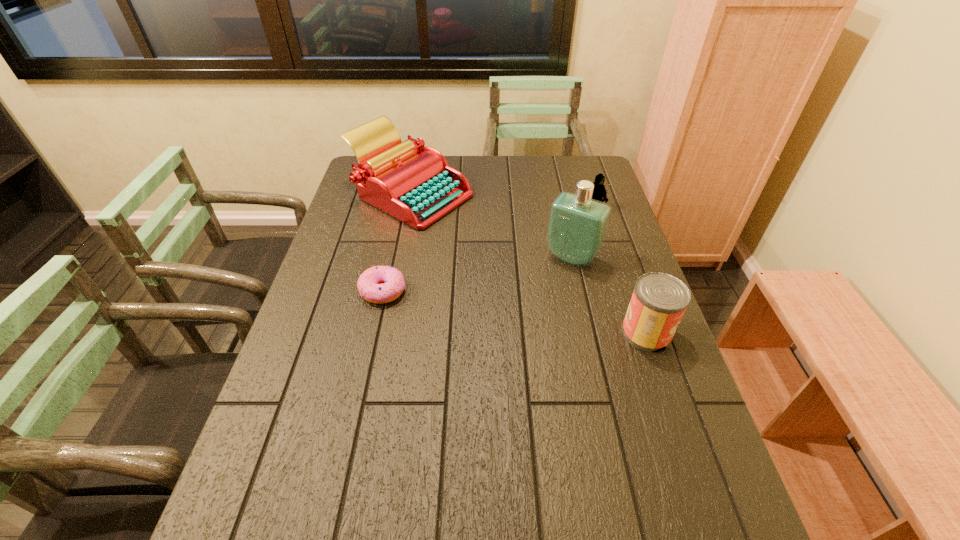
Identify the location of empty location between the shortest object and the fourth shortest object. Image resolution: width=960 pixels, height=540 pixels. (396, 242).

At what (x,y) coordinates should I click in order to perform the action: click on empty space that is in between the fourth tallest object and the typewriter. Please return your answer as a coordinate pair (x, y). Looking at the image, I should click on (502, 201).

What are the coordinates of `empty location between the typewriter and the doughnut` in the screenshot? It's located at (396, 242).

At what (x,y) coordinates should I click in order to perform the action: click on vacant region between the Lego and the third tallest object. Please return your answer as a coordinate pair (x, y). The width and height of the screenshot is (960, 540). Looking at the image, I should click on (620, 270).

The image size is (960, 540). I want to click on vacant space that's between the tallest object and the can, so click(x=610, y=295).

Where is `empty location between the perfume and the nearest object`? empty location between the perfume and the nearest object is located at coordinates (610, 295).

The height and width of the screenshot is (540, 960). Identify the location of empty space between the shortest object and the third tallest object. (515, 312).

You are a GUI agent. You are given a task and a screenshot of the screen. Output one action in this format:
    pyautogui.click(x=<x>, y=<y>)
    Task: Click on the free space between the tallest object and the doughnut
    This screenshot has height=540, width=960.
    Given the screenshot: What is the action you would take?
    pyautogui.click(x=477, y=274)

Where is `object that is the closest one to the Lego`? Image resolution: width=960 pixels, height=540 pixels. object that is the closest one to the Lego is located at coordinates (577, 227).

Point out which object is positioned as the nearest to the fourth shortest object. Please provide its 2D coordinates. Your answer should be formatted as a tuple, i.e. [(x, y)], where the tuple contains the x and y coordinates of a point satisfying the conditions above.

[(369, 287)]